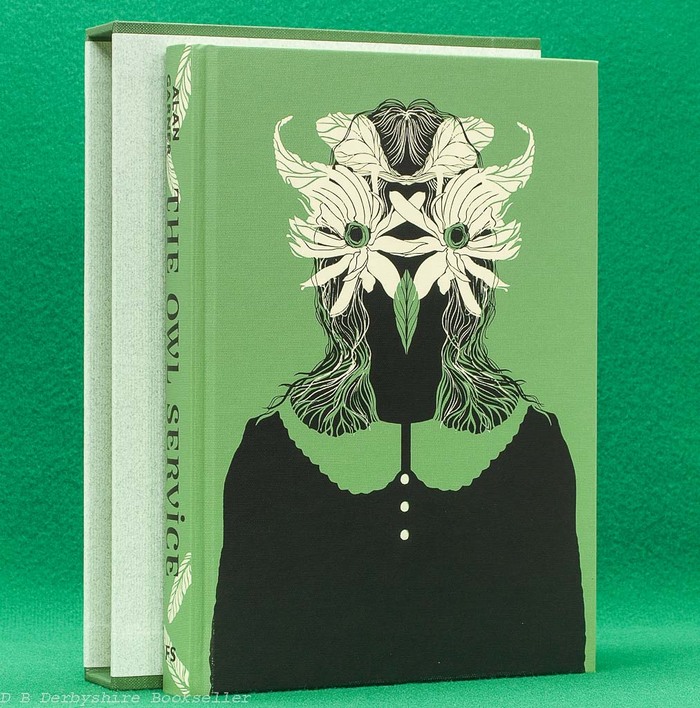
Identify the location of book sleeve. (134, 175).